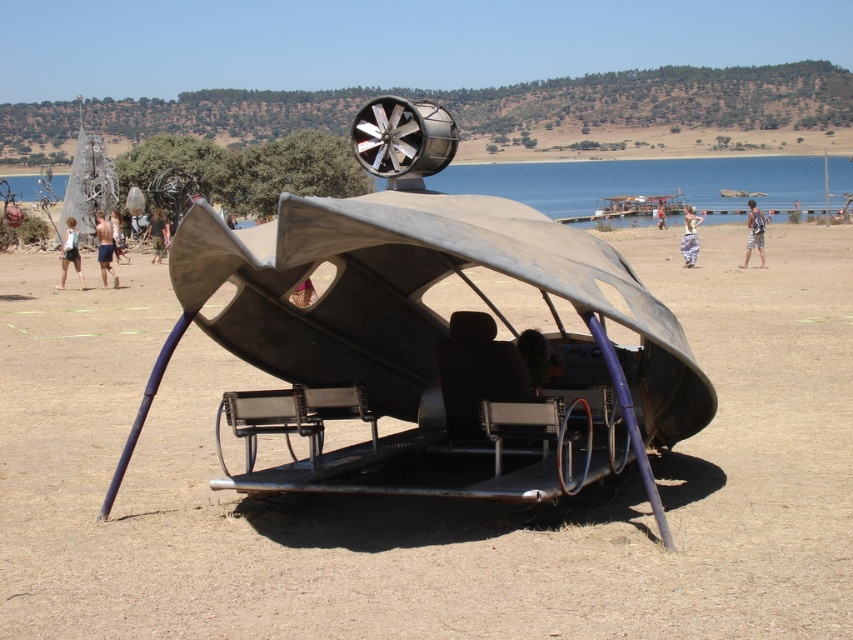
You are standing on the beach and see both the camouflage fabric person at center and the white fabric dress at center. Which one is closer to you?

The camouflage fabric person at center is closer to you because they are in front of the white fabric dress at center.